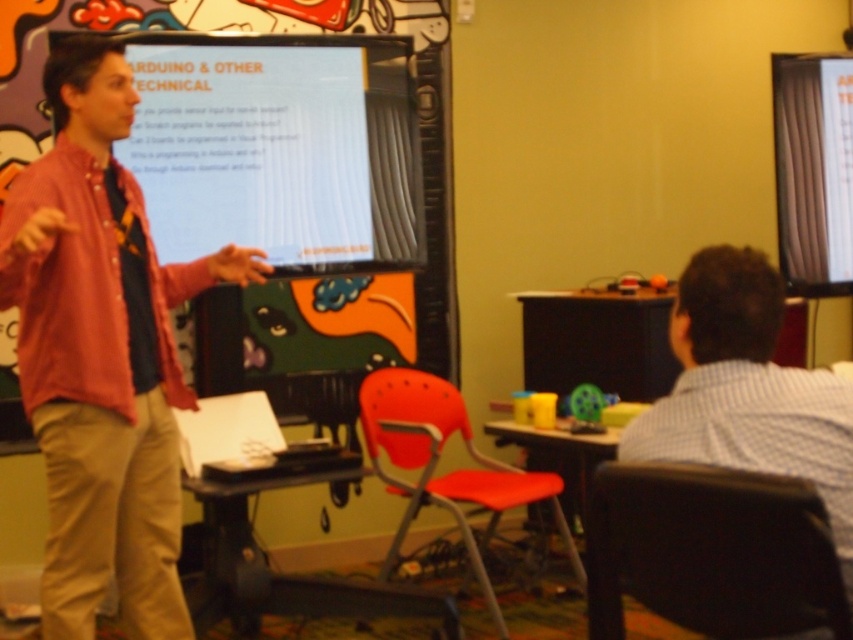
You are a student sitting in the classroom and want to see the presenter clearly. The presenter is wearing a red shirt and khaki pants. There is a white striped shirt at right located at point (747, 392). Is the white striped shirt at right blocking your view of the presenter?

The white striped shirt at right located at point (747, 392) is blocking your view of the presenter because it is positioned at that specific coordinate which might be in front of the presenter.